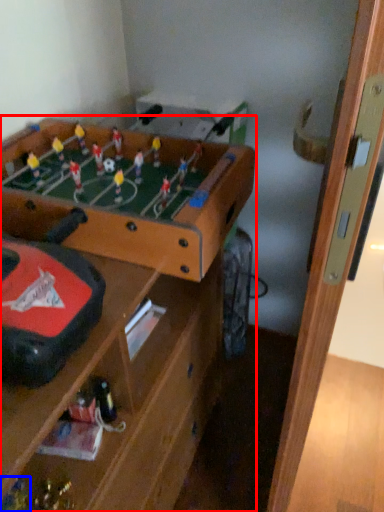
Question: Which object is further to the camera taking this photo, table (highlighted by a red box) or toy (highlighted by a blue box)?

Choices:
 (A) table
 (B) toy

Answer: (B)